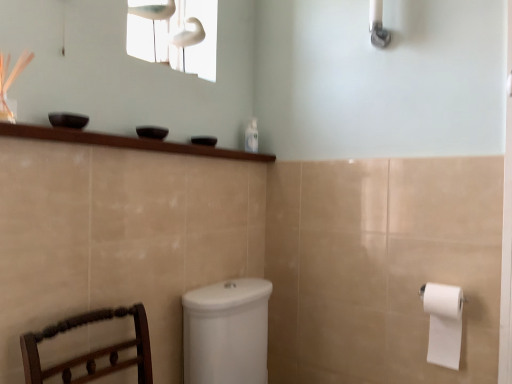
Question: Can you confirm if white glossy window screen at upper center is shorter than white glossy shower head at upper right?

Choices:
 (A) no
 (B) yes

Answer: (A)

Question: Considering the relative positions of white glossy window screen at upper center and white glossy shower head at upper right in the image provided, is white glossy window screen at upper center to the left of white glossy shower head at upper right from the viewer's perspective?

Choices:
 (A) no
 (B) yes

Answer: (B)

Question: Considering the relative sizes of white glossy window screen at upper center and white glossy shower head at upper right in the image provided, is white glossy window screen at upper center bigger than white glossy shower head at upper right?

Choices:
 (A) yes
 (B) no

Answer: (A)

Question: Does white glossy window screen at upper center appear on the right side of white glossy shower head at upper right?

Choices:
 (A) no
 (B) yes

Answer: (A)

Question: Is white glossy window screen at upper center further to the viewer compared to white glossy shower head at upper right?

Choices:
 (A) yes
 (B) no

Answer: (A)

Question: From the image's perspective, is white glossy window screen at upper center over white glossy shower head at upper right?

Choices:
 (A) no
 (B) yes

Answer: (A)

Question: Is white matte toilet paper at right a part of white glossy shower head at upper right?

Choices:
 (A) no
 (B) yes

Answer: (A)

Question: Is white glossy shower head at upper right thinner than white matte toilet paper at right?

Choices:
 (A) no
 (B) yes

Answer: (B)

Question: Is white glossy shower head at upper right bigger than white matte toilet paper at right?

Choices:
 (A) no
 (B) yes

Answer: (A)

Question: From a real-world perspective, does white glossy shower head at upper right stand above white matte toilet paper at right?

Choices:
 (A) no
 (B) yes

Answer: (B)

Question: Is white glossy shower head at upper right far away from white matte toilet paper at right?

Choices:
 (A) no
 (B) yes

Answer: (B)

Question: From the image's perspective, does white glossy shower head at upper right appear lower than white matte toilet paper at right?

Choices:
 (A) yes
 (B) no

Answer: (B)

Question: From a real-world perspective, is white glossy window screen at upper center on clear plastic bottle at upper center?

Choices:
 (A) yes
 (B) no

Answer: (A)